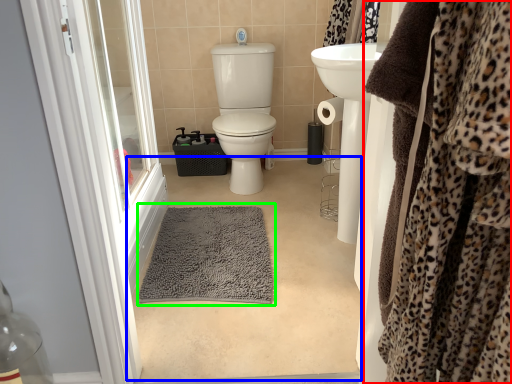
Question: Which object is positioned closest to clothing (highlighted by a red box)? Select from plain (highlighted by a blue box) and bath mat (highlighted by a green box).

Choices:
 (A) plain
 (B) bath mat

Answer: (A)